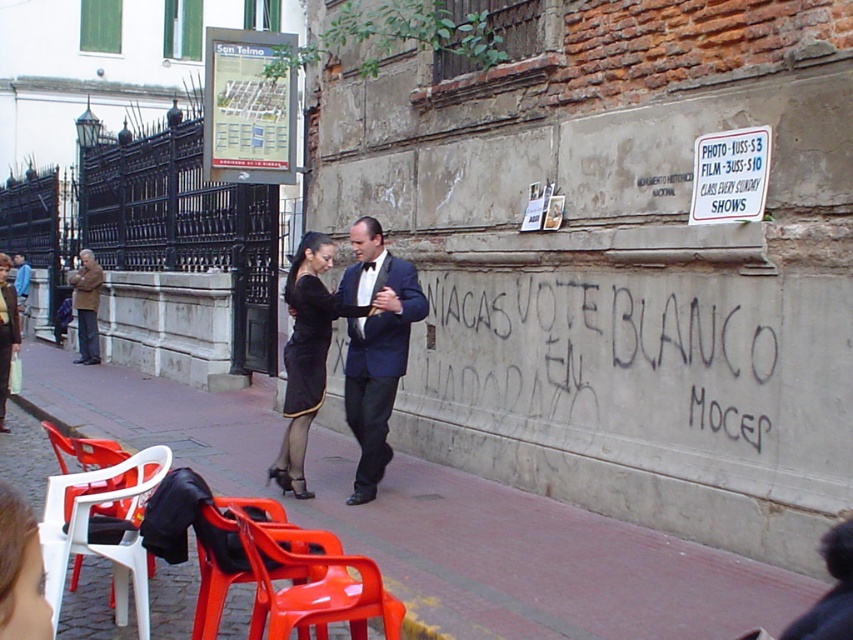
Who is positioned more to the right, shiny dark blue suit at center or matte black dress at center?

From the viewer's perspective, shiny dark blue suit at center appears more on the right side.

Who is shorter, shiny dark blue suit at center or matte black dress at center?

Standing shorter between the two is matte black dress at center.

Which is behind, point (358, 490) or point (15, 300)?

Point (15, 300)

Find the location of `shiny dark blue suit at center`. shiny dark blue suit at center is located at coordinates (375, 346).

Is white plastic chair at lower left positioned in front of orange plastic chair at lower left?

No, it is behind orange plastic chair at lower left.

Does white plastic chair at lower left appear on the right side of orange plastic chair at lower left?

Incorrect, white plastic chair at lower left is not on the right side of orange plastic chair at lower left.

Locate an element on the screen. Image resolution: width=853 pixels, height=640 pixels. white plastic chair at lower left is located at coordinates (102, 529).

The width and height of the screenshot is (853, 640). I want to click on white plastic chair at lower left, so click(x=102, y=529).

Between shiny dark blue suit at center and white plastic chair at lower left, which one appears on the right side from the viewer's perspective?

From the viewer's perspective, shiny dark blue suit at center appears more on the right side.

Does point (413, 266) lie in front of point (144, 609)?

No, (413, 266) is behind (144, 609).

Which is in front, point (374, 264) or point (68, 513)?

Point (68, 513) is in front.

Where is `shiny dark blue suit at center`? This screenshot has width=853, height=640. shiny dark blue suit at center is located at coordinates (375, 346).